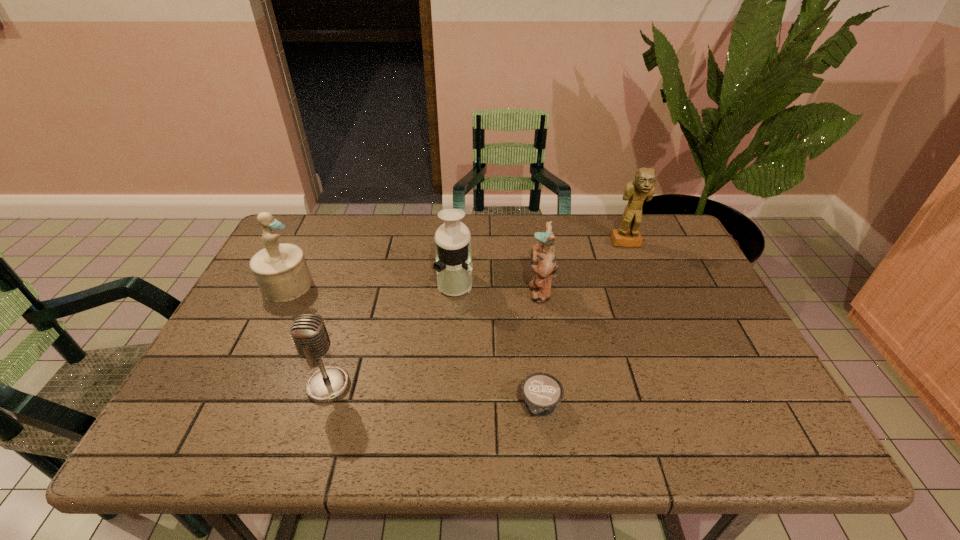
Where is `free spot that satisfies the following two spatial constraints: 1. at the beak of the leftmost figurine; 2. on the back side of the yogurt`? This screenshot has width=960, height=540. free spot that satisfies the following two spatial constraints: 1. at the beak of the leftmost figurine; 2. on the back side of the yogurt is located at coordinates (228, 407).

The height and width of the screenshot is (540, 960). I want to click on free spot that satisfies the following two spatial constraints: 1. at the beak of the microphone; 2. on the right side of the leftmost figurine, so click(238, 385).

Identify the location of vacant area that satisfies the following two spatial constraints: 1. on the front-facing side of the farthest object; 2. on the front-facing side of the second figurine from right to left. The image size is (960, 540). (646, 291).